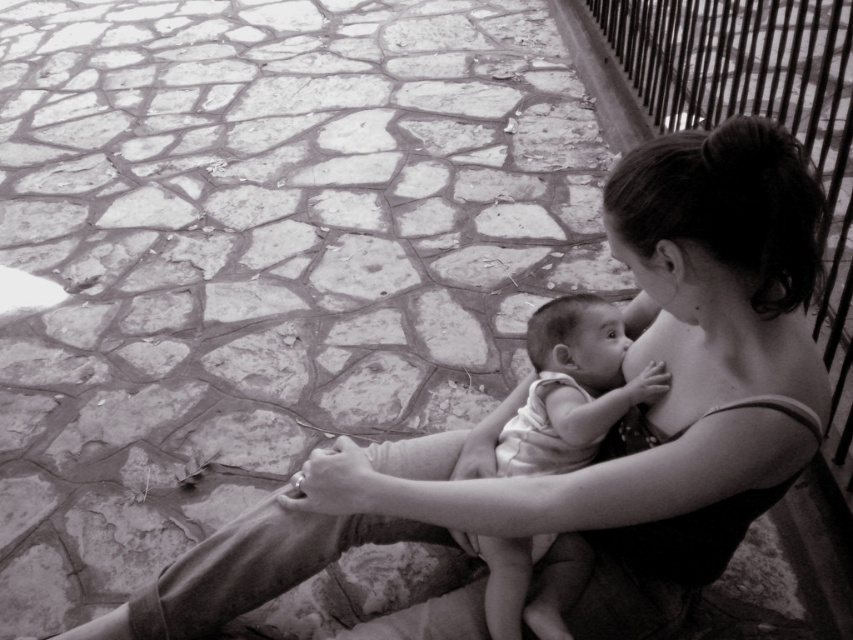
Question: Which object is closer to the camera taking this photo?

Choices:
 (A) white clothed baby at center
 (B) metallic wire fence at upper right

Answer: (B)

Question: Is metallic wire fence at upper right smaller than white clothed baby at center?

Choices:
 (A) no
 (B) yes

Answer: (A)

Question: Which of the following is the farthest from the observer?

Choices:
 (A) metallic wire fence at upper right
 (B) white clothed baby at center

Answer: (B)

Question: Does metallic wire fence at upper right have a smaller size compared to white clothed baby at center?

Choices:
 (A) no
 (B) yes

Answer: (A)

Question: Does metallic wire fence at upper right appear over white clothed baby at center?

Choices:
 (A) yes
 (B) no

Answer: (A)

Question: Which point is closer to the camera taking this photo?

Choices:
 (A) (838, 106)
 (B) (479, 556)

Answer: (B)